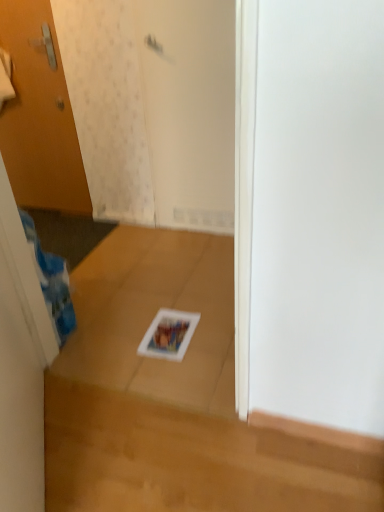
You are a GUI agent. You are given a task and a screenshot of the screen. Output one action in this format:
    pyautogui.click(x=<x>, y=<y>)
    Task: Click on the empty space that is in between white matte screen door at upper center and matte white magazine at center
    
    Given the screenshot: What is the action you would take?
    pyautogui.click(x=186, y=274)